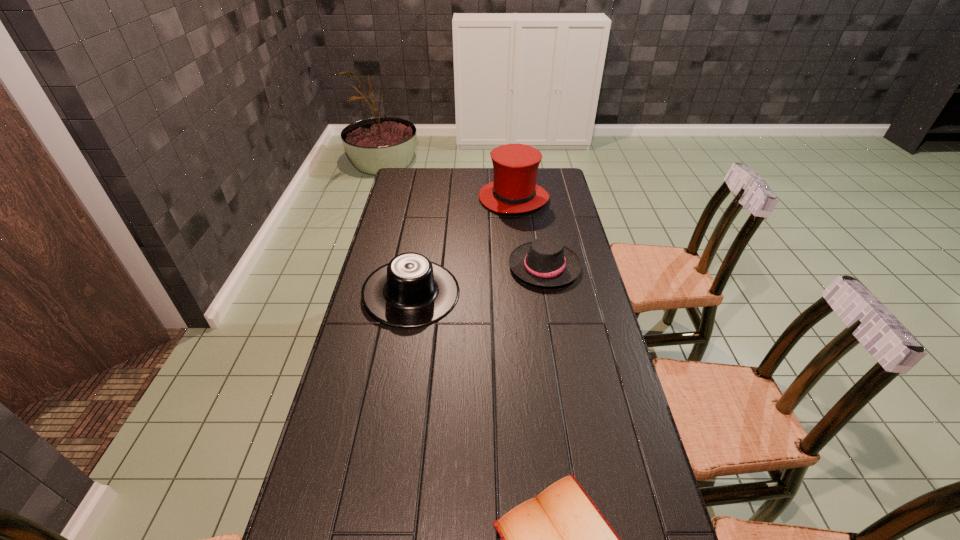
Identify the location of object that is at the far right corner. Image resolution: width=960 pixels, height=540 pixels. (514, 190).

Identify the location of free space at the far edge of the desktop. The height and width of the screenshot is (540, 960). (464, 185).

At what (x,y) coordinates should I click in order to perform the action: click on vacant space at the left edge. Please return your answer as a coordinate pair (x, y). Looking at the image, I should click on (339, 493).

In the image, there is a desktop. Where is `vacant space at the right edge`? vacant space at the right edge is located at coordinates (612, 361).

The height and width of the screenshot is (540, 960). Find the location of `free space at the far left corner of the desktop`. free space at the far left corner of the desktop is located at coordinates 401,189.

Find the location of a particular element. vacant space at the far right corner is located at coordinates (548, 185).

At what (x,y) coordinates should I click in order to perform the action: click on vacant area between the leftmost object and the third tallest object. Please return your answer as a coordinate pair (x, y). Image resolution: width=960 pixels, height=540 pixels. Looking at the image, I should click on (478, 280).

Locate an element on the screen. The height and width of the screenshot is (540, 960). empty location between the tallest object and the leftmost dress hat is located at coordinates (463, 246).

This screenshot has height=540, width=960. I want to click on unoccupied position between the shortest dress hat and the farthest dress hat, so click(529, 232).

Identify the location of vacant point located between the leftmost dress hat and the shortest dress hat. (478, 280).